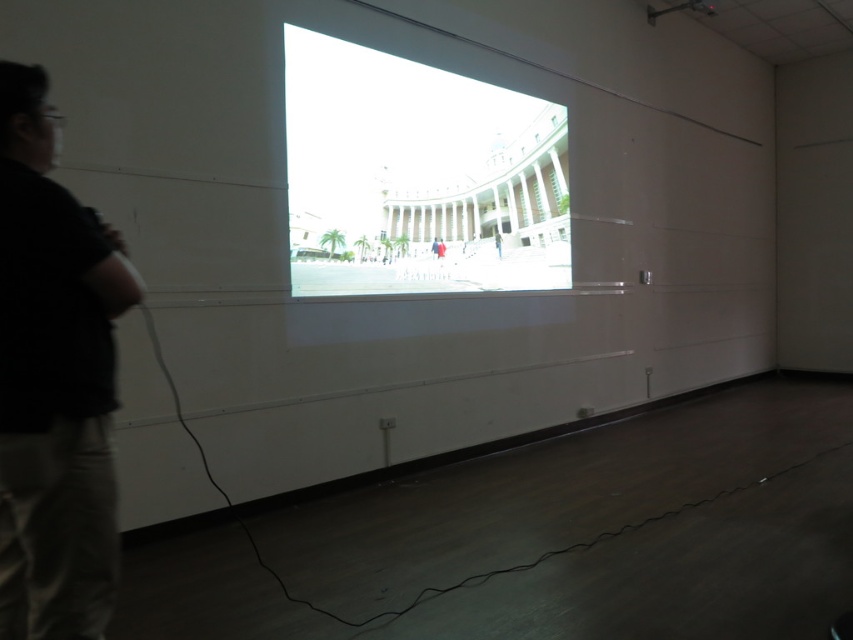
Is bright white projection screen at center further to camera compared to black cotton shirt at left?

Yes, it is behind black cotton shirt at left.

Can you confirm if bright white projection screen at center is shorter than black cotton shirt at left?

No.

Between point (289, 195) and point (0, 412), which one is positioned behind?

The point (289, 195) is behind.

You are a GUI agent. You are given a task and a screenshot of the screen. Output one action in this format:
    pyautogui.click(x=<x>, y=<y>)
    Task: Click on the bright white projection screen at center
    The image size is (853, 640).
    Given the screenshot: What is the action you would take?
    pyautogui.click(x=416, y=177)